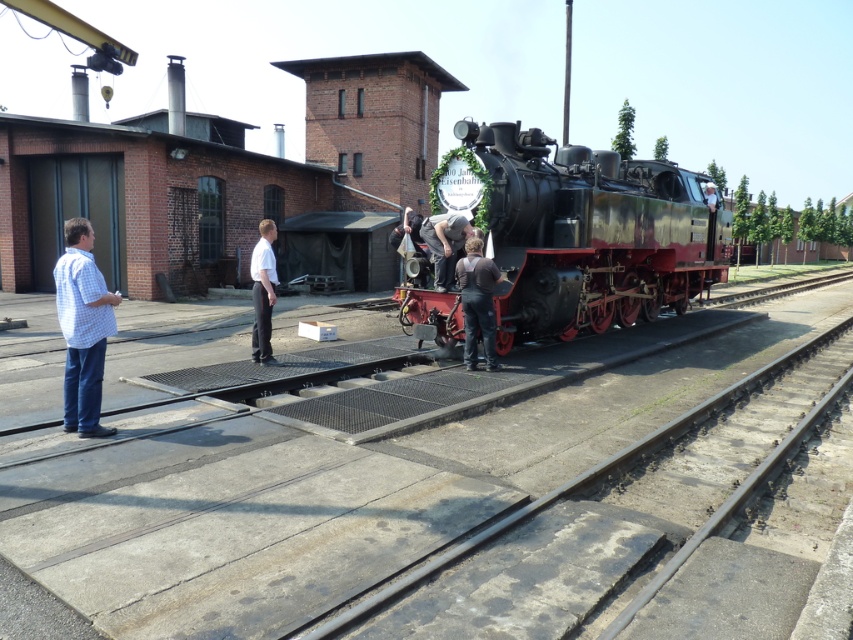
In the scene shown: Is shiny black locomotive at center positioned behind checkered shirt at left?

Yes, shiny black locomotive at center is behind checkered shirt at left.

In the scene shown: Measure the distance between point (500, 266) and camera.

They are 10.55 meters apart.

Is point (685, 308) more distant than point (82, 316)?

Yes, it is behind point (82, 316).

Image resolution: width=853 pixels, height=640 pixels. I want to click on shiny black locomotive at center, so click(x=583, y=230).

Is white shirt at center wider than dark gray fabric pants at center?

No.

Can you confirm if white shirt at center is positioned to the right of dark gray fabric pants at center?

Incorrect, white shirt at center is not on the right side of dark gray fabric pants at center.

The image size is (853, 640). Find the location of `white shirt at center`. white shirt at center is located at coordinates (263, 291).

Is shiny black locomotive at center behind dark brown leather jacket at center?

Yes, shiny black locomotive at center is behind dark brown leather jacket at center.

The image size is (853, 640). What do you see at coordinates (583, 230) in the screenshot? I see `shiny black locomotive at center` at bounding box center [583, 230].

Between point (570, 316) and point (474, 305), which one is positioned in front?

Point (474, 305) is in front.

Image resolution: width=853 pixels, height=640 pixels. Identify the location of shiny black locomotive at center. (583, 230).